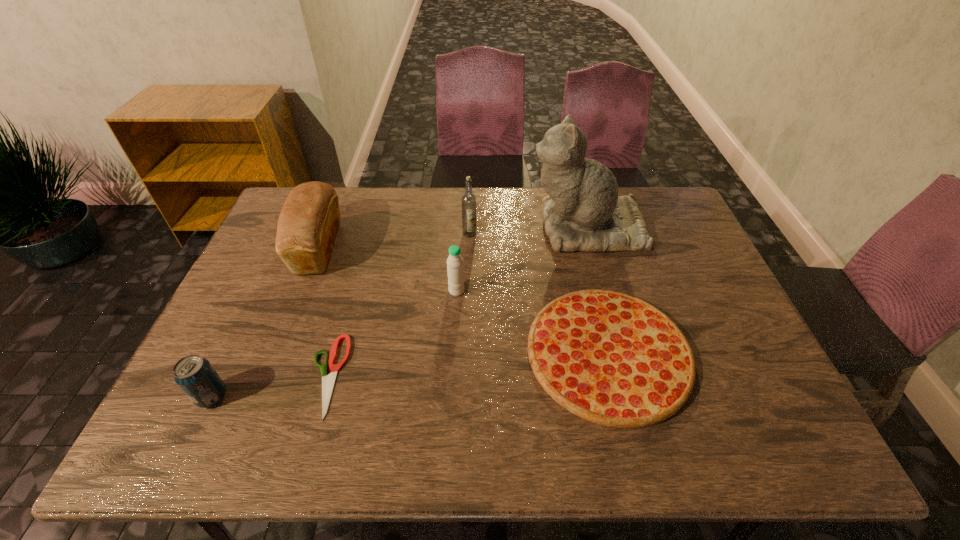
You are a GUI agent. You are given a task and a screenshot of the screen. Output one action in this format:
    pyautogui.click(x=<x>, y=<y>)
    Task: Click on the pizza that is at the near edge
    The image size is (960, 540).
    Given the screenshot: What is the action you would take?
    pyautogui.click(x=610, y=358)

Identify the location of scissors that is positioned at the near edge. (328, 381).

Locate an element on the screen. The width and height of the screenshot is (960, 540). bread present at the left edge is located at coordinates (309, 220).

Find the location of a particular element. The image size is (960, 540). pop soda that is at the left edge is located at coordinates (196, 377).

The height and width of the screenshot is (540, 960). What are the coordinates of `object that is at the right edge` in the screenshot? It's located at (583, 212).

Where is `object that is at the far left corner`? The height and width of the screenshot is (540, 960). object that is at the far left corner is located at coordinates (309, 220).

Where is `object located in the far right corner section of the desktop`? The image size is (960, 540). object located in the far right corner section of the desktop is located at coordinates (583, 212).

The height and width of the screenshot is (540, 960). Find the location of `vacant space at the far edge`. vacant space at the far edge is located at coordinates (438, 219).

In the image, there is a desktop. What are the coordinates of `vacant space at the left edge` in the screenshot? It's located at (274, 232).

Find the location of a particular element. vacant space at the right edge is located at coordinates (690, 253).